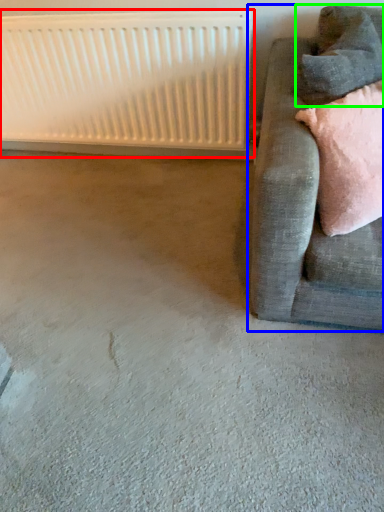
Question: Based on their relative distances, which object is nearer to radiator (highlighted by a red box)? Choose from studio couch (highlighted by a blue box) and pillow (highlighted by a green box).

Choices:
 (A) studio couch
 (B) pillow

Answer: (A)